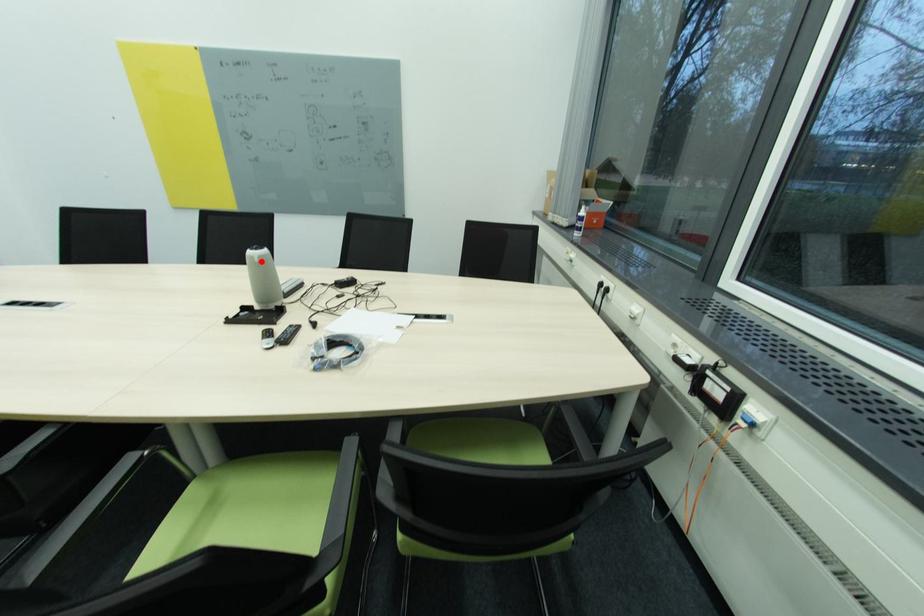
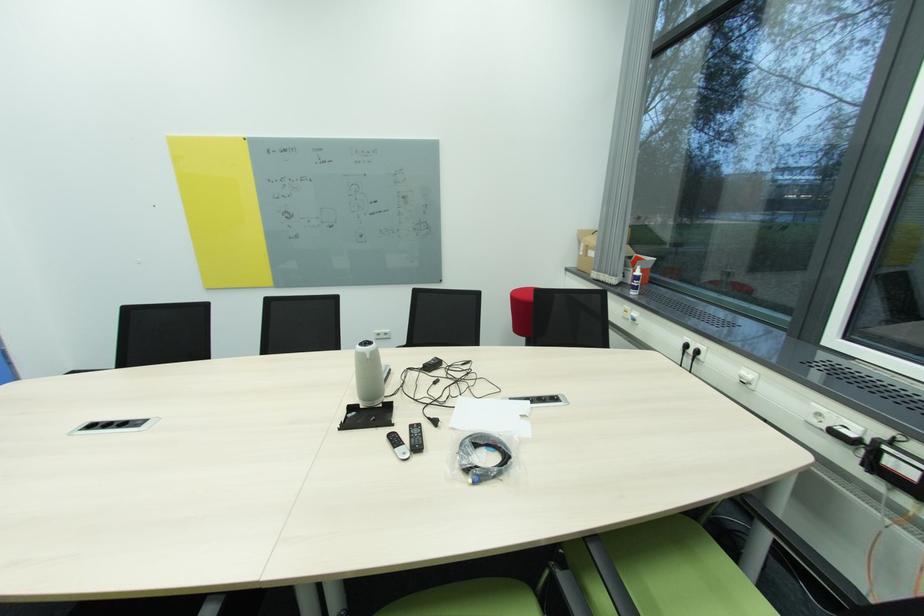
Question: I am providing you with two images of the same scene from different viewpoints. Image1 has a red point marked. In image2, the corresponding 3D location appears at what relative position? Reply with the corresponding letter.

Choices:
 (A) Closer
 (B) Farther

Answer: (A)